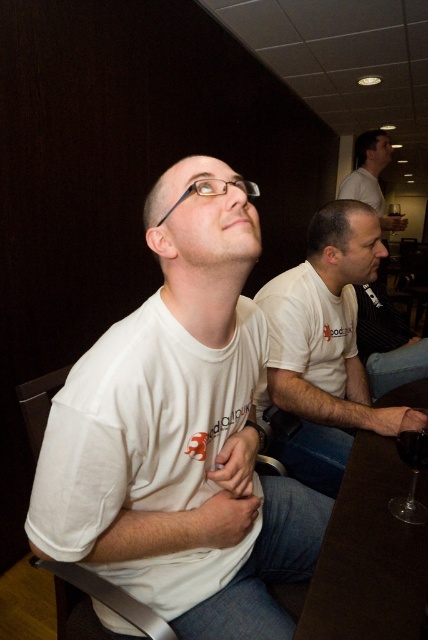
Which of these two, transparent glass wine at table right or transparent glass at upper right, stands taller?

transparent glass at upper right is taller.

Between transparent glass wine at table right and transparent glass at upper right, which one appears on the right side from the viewer's perspective?

Positioned to the right is transparent glass at upper right.

Which is behind, point (410, 451) or point (401, 212)?

The point (401, 212) is more distant.

Find the location of `transparent glass wine at table right`. transparent glass wine at table right is located at coordinates (413, 449).

Can you confirm if brown wooden table at lower right is thinner than transparent glass wine glass at lower right?

Incorrect, brown wooden table at lower right's width is not less than transparent glass wine glass at lower right's.

Is brown wooden table at lower right further to the viewer compared to transparent glass wine glass at lower right?

No.

Where is `brown wooden table at lower right`? This screenshot has height=640, width=428. brown wooden table at lower right is located at coordinates (368, 556).

This screenshot has width=428, height=640. Identify the location of brown wooden table at lower right. point(368,556).

Does white t-shirt at upper center have a smaller size compared to transparent glass at upper right?

Indeed, white t-shirt at upper center has a smaller size compared to transparent glass at upper right.

Where is `white t-shirt at upper center`? The image size is (428, 640). white t-shirt at upper center is located at coordinates (371, 177).

Locate an element on the screen. Image resolution: width=428 pixels, height=640 pixels. white t-shirt at upper center is located at coordinates (371, 177).